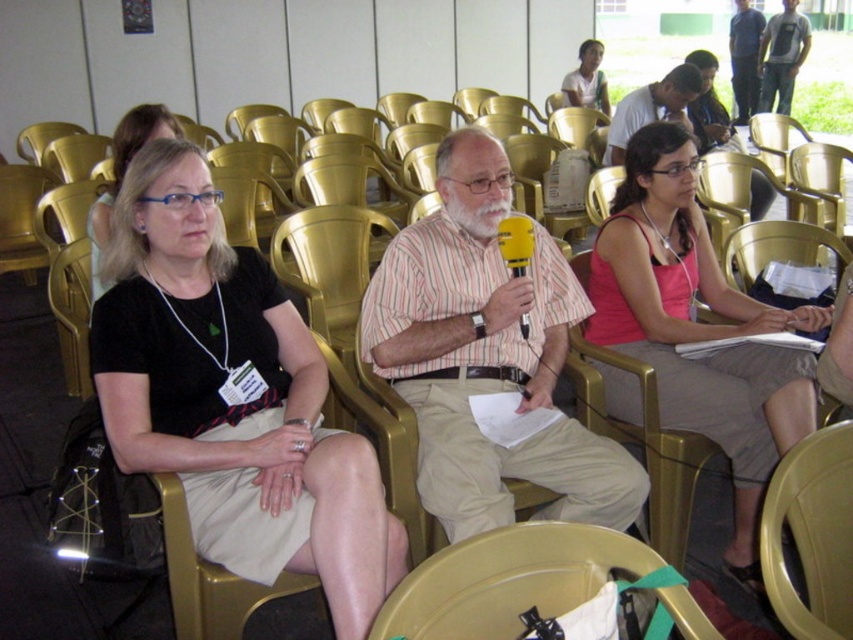
You are standing at the entrance of the conference area and see the point marked at coordinates (x=811, y=534). What object is located at that point?

The point at coordinates (x=811, y=534) corresponds to the matte yellow chair at lower right.

You are organizing a small event and need to place a 1.2 meter long banner between the black fabric skirt at center and the pink fabric tank top at center. Is there enough space between them to fit the banner?

The distance between the black fabric skirt at center and the pink fabric tank top at center is 1.17 meters, which is slightly shorter than the 1.2 meter banner. Therefore, there isn not enough space to fit the banner between them.